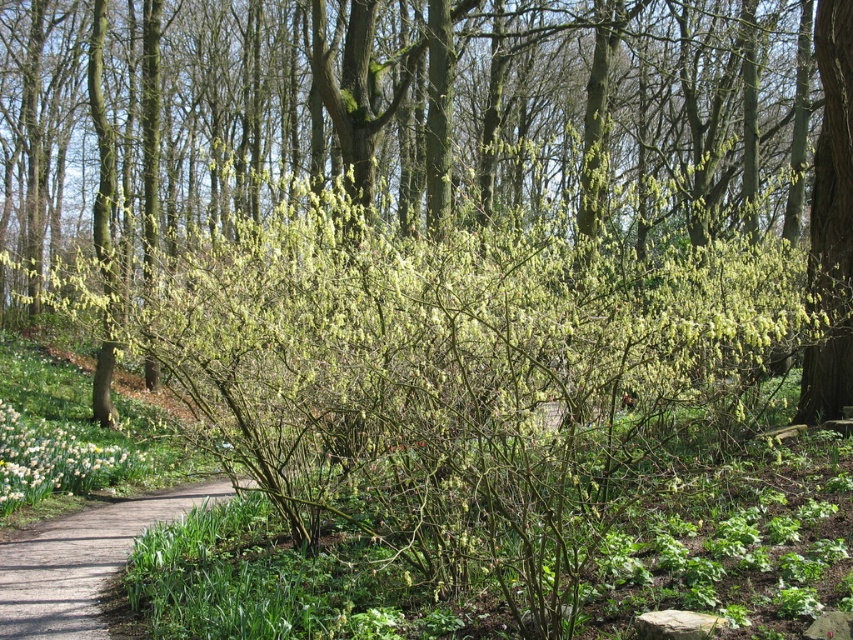
In the scene shown: You are standing in the woodland scene and want to place a small flag at each of the two points labeled point [111,572] and point [102,486]. Which point will have its flag closer to your eyes?

The flag placed at point [111,572] will be closer to your eyes because it is closer to the camera than point [102,486].

You are standing in the woodland scene and want to take a photo of the green leafy bush at center. Where should you position yourself to capture it in the frame?

The green leafy bush at center is located at coordinates approximately 0.197 on the horizontal axis and 0.509 on the vertical axis. To capture it in your frame, position yourself so the camera is aligned with these coordinates.

You are a gardener who needs to walk from the brown gravel path at lower left to the green leafy bush at center. Is there enough space to walk directly between them?

The green leafy bush at center might be wider than brown gravel path at lower left, so there might not be enough space to walk directly between them.